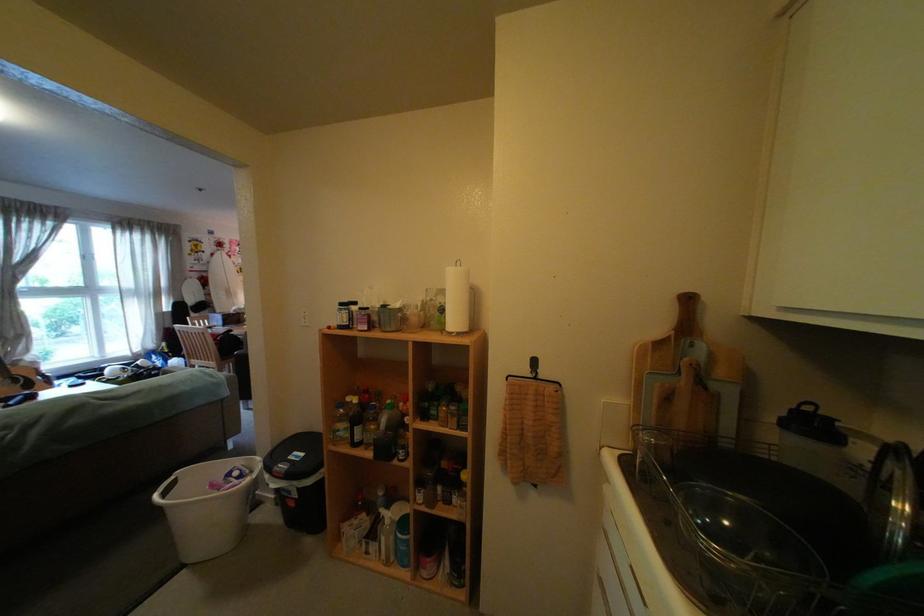
Locate an element on the screen. chair sitting surface is located at coordinates (200, 347).